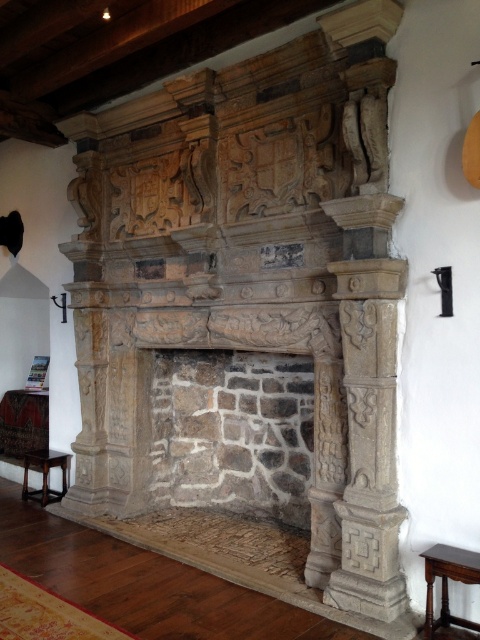
You are an interior designer planning to place a decorative item on the wooden stool at lower right. Considering the stone fireplace at center is above it, where should you position the item to ensure it is visible from the main seating area?

Since the stone fireplace at center is above the wooden stool at lower right, positioning the decorative item on the wooden stool at lower right would make it visible from the main seating area as it is placed below the fireplace.

You are a painter standing 1.5 meters away from the dark brown wood stool at lower left. You want to paint the stone fireplace at center. Can you reach it without moving the stool?

The distance between the stone fireplace at center and the dark brown wood stool at lower left is 1.73 meters. Since you are already 1.5 meters away from the stool, you are 0.23 meters away from the stone fireplace at center. Therefore, you can reach it without moving the stool.